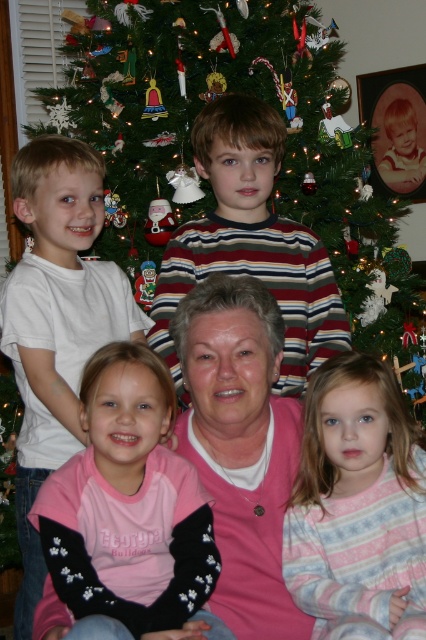
In the scene shown: You are standing in the living room where the Christmas tree is. You see two points marked in the image. The first point is at coordinates point (x=348, y=525) and the second point is at point (x=244, y=220). Which point is closer to you?

Point (x=348, y=525) is in front of point (x=244, y=220), so it is closer to you.